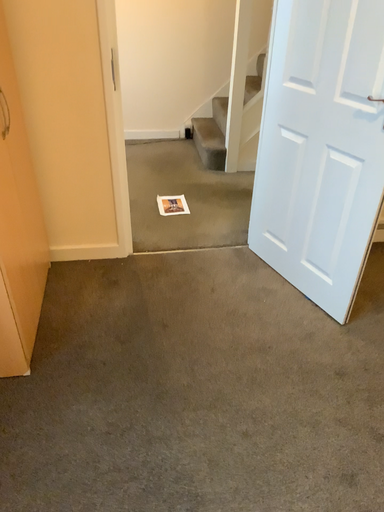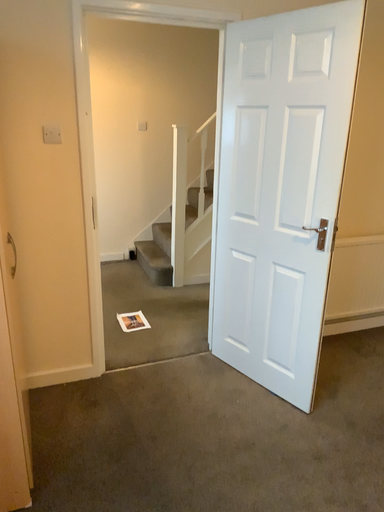
Question: How did the camera likely rotate when shooting the video?

Choices:
 (A) rotated downward
 (B) rotated upward

Answer: (B)